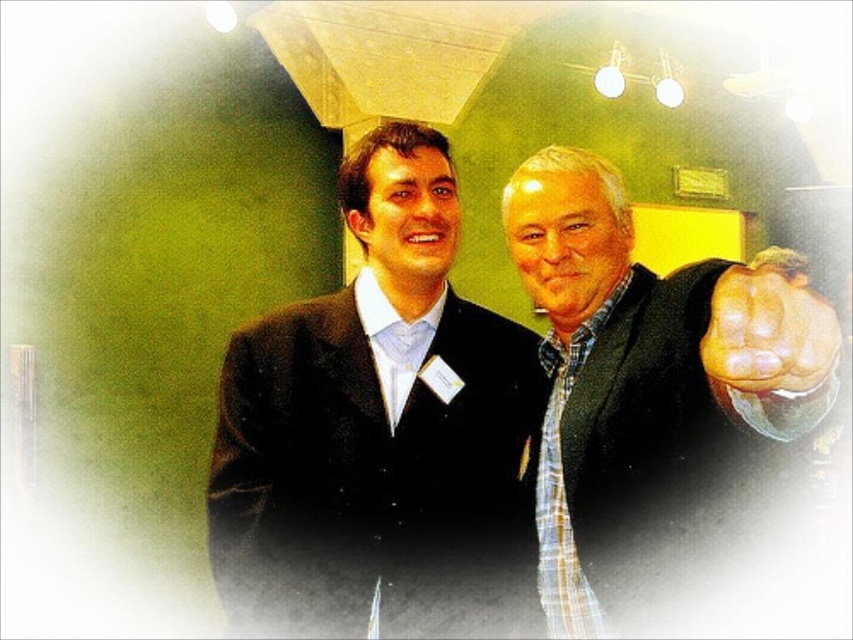
Which is more to the left, black woolen suit at center or plaid shirt at right?

black woolen suit at center

Looking at this image, is black woolen suit at center above plaid shirt at right?

No, black woolen suit at center is not above plaid shirt at right.

What do you see at coordinates (375, 468) in the screenshot? I see `black woolen suit at center` at bounding box center [375, 468].

You are a GUI agent. You are given a task and a screenshot of the screen. Output one action in this format:
    pyautogui.click(x=<x>, y=<y>)
    Task: Click on the black woolen suit at center
    Image resolution: width=853 pixels, height=640 pixels.
    Given the screenshot: What is the action you would take?
    pyautogui.click(x=375, y=468)

Consider the image. Is black woolen suit at center above muscular skin fist at right?

No.

Locate an element on the screen. Image resolution: width=853 pixels, height=640 pixels. black woolen suit at center is located at coordinates (375, 468).

Which is more to the left, plaid shirt at right or muscular skin fist at right?

plaid shirt at right

Is point (579, 198) in front of point (780, 330)?

No, (579, 198) is further to viewer.

Is point (657, 342) positioned behind point (802, 362)?

Yes, point (657, 342) is farther from viewer.

Where is `plaid shirt at right`? plaid shirt at right is located at coordinates (647, 365).